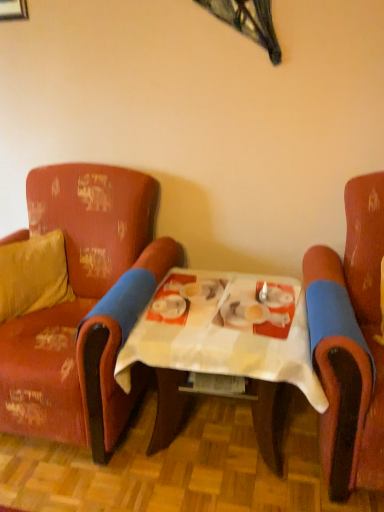
In the scene shown: What is the approximate height of velvet yellow pillow at left?

It is 35.16 centimeters.

Measure the distance between distressed red fabric armchair at left, the first chair in the left-to-right sequence, and camera.

A distance of 1.40 meters exists between distressed red fabric armchair at left, the first chair in the left-to-right sequence, and camera.

This screenshot has height=512, width=384. What do you see at coordinates (220, 338) in the screenshot?
I see `white checkered table at center` at bounding box center [220, 338].

Identify the location of velvet yellow pillow at left. This screenshot has width=384, height=512. (33, 275).

Is white checkered table at center far away from distressed red fabric armchair at left, which appears as the second chair when viewed from the right?

No, white checkered table at center is in close proximity to distressed red fabric armchair at left, which appears as the second chair when viewed from the right.

Is white checkered table at center surrounding distressed red fabric armchair at left, which appears as the second chair when viewed from the right?

No, distressed red fabric armchair at left, which appears as the second chair when viewed from the right, is not surrounded by white checkered table at center.

Which of these two, white checkered table at center or distressed red fabric armchair at left, the first chair in the left-to-right sequence, is smaller?

With smaller size is white checkered table at center.

Is white checkered table at center oriented towards distressed red fabric armchair at left, which appears as the second chair when viewed from the right?

No, white checkered table at center is not aimed at distressed red fabric armchair at left, which appears as the second chair when viewed from the right.

Is white checkered table at center taller than velvet yellow pillow at left?

No, white checkered table at center is not taller than velvet yellow pillow at left.

Is point (153, 324) positioned in front of point (11, 290)?

Yes, it is in front of point (11, 290).

Based on the photo, can you tell me how much white checkered table at center and velvet yellow pillow at left differ in facing direction?

There is a 51.5-degree angle between the facing directions of white checkered table at center and velvet yellow pillow at left.

From a real-world perspective, which is physically above, white checkered table at center or velvet yellow pillow at left?

velvet yellow pillow at left.

Can you tell me how much distressed red fabric armchair at left, the first chair in the left-to-right sequence, and white checkered table at center differ in facing direction?

The facing directions of distressed red fabric armchair at left, the first chair in the left-to-right sequence, and white checkered table at center are 2.26 degrees apart.

Between distressed red fabric armchair at left, which appears as the second chair when viewed from the right, and white checkered table at center, which one is positioned behind?

distressed red fabric armchair at left, which appears as the second chair when viewed from the right, is further from the camera.

Looking at the image, does distressed red fabric armchair at left, which appears as the second chair when viewed from the right, seem bigger or smaller compared to white checkered table at center?

distressed red fabric armchair at left, which appears as the second chair when viewed from the right, is bigger than white checkered table at center.

Is distressed red fabric armchair at left, the first chair in the left-to-right sequence, next to white checkered table at center and touching it?

No, distressed red fabric armchair at left, the first chair in the left-to-right sequence, is not beside white checkered table at center.

In the scene shown: Based on their sizes in the image, would you say distressed red fabric armchair at left, which appears as the second chair when viewed from the right, is bigger or smaller than velvet yellow pillow at left?

Clearly, distressed red fabric armchair at left, which appears as the second chair when viewed from the right, is larger in size than velvet yellow pillow at left.

Would you say distressed red fabric armchair at left, which appears as the second chair when viewed from the right, is inside or outside velvet yellow pillow at left?

distressed red fabric armchair at left, which appears as the second chair when viewed from the right, lies outside velvet yellow pillow at left.

Based on the photo, is distressed red fabric armchair at left, the first chair in the left-to-right sequence, beside velvet yellow pillow at left?

There is a gap between distressed red fabric armchair at left, the first chair in the left-to-right sequence, and velvet yellow pillow at left.

Is distressed red fabric armchair at left, which appears as the second chair when viewed from the right, oriented away from velvet yellow pillow at left?

Yes, distressed red fabric armchair at left, which appears as the second chair when viewed from the right,'s orientation is away from velvet yellow pillow at left.

Is scratched leather armchair at right, placed as the 1th chair when sorted from right to left, directly adjacent to velvet yellow pillow at left?

scratched leather armchair at right, placed as the 1th chair when sorted from right to left, and velvet yellow pillow at left are clearly separated.

Considering the positions of objects scratched leather armchair at right, marked as the 2th chair in a left-to-right arrangement, and velvet yellow pillow at left in the image provided, who is in front, scratched leather armchair at right, marked as the 2th chair in a left-to-right arrangement, or velvet yellow pillow at left?

scratched leather armchair at right, marked as the 2th chair in a left-to-right arrangement, is more forward.

Can you tell me how much scratched leather armchair at right, marked as the 2th chair in a left-to-right arrangement, and velvet yellow pillow at left differ in facing direction?

49.3 degrees.

Considering the relative sizes of scratched leather armchair at right, marked as the 2th chair in a left-to-right arrangement, and velvet yellow pillow at left in the image provided, is scratched leather armchair at right, marked as the 2th chair in a left-to-right arrangement, bigger than velvet yellow pillow at left?

Yes, scratched leather armchair at right, marked as the 2th chair in a left-to-right arrangement, is bigger than velvet yellow pillow at left.

Are scratched leather armchair at right, placed as the 1th chair when sorted from right to left, and white checkered table at center far apart?

Actually, scratched leather armchair at right, placed as the 1th chair when sorted from right to left, and white checkered table at center are a little close together.

Is scratched leather armchair at right, marked as the 2th chair in a left-to-right arrangement, wider or thinner than white checkered table at center?

scratched leather armchair at right, marked as the 2th chair in a left-to-right arrangement, is wider than white checkered table at center.

Visually, is scratched leather armchair at right, marked as the 2th chair in a left-to-right arrangement, positioned to the left or to the right of white checkered table at center?

Clearly, scratched leather armchair at right, marked as the 2th chair in a left-to-right arrangement, is on the right of white checkered table at center in the image.

From a real-world perspective, which object rests below the other?

From a 3D spatial view, white checkered table at center is below.

Which is more to the right, scratched leather armchair at right, placed as the 1th chair when sorted from right to left, or distressed red fabric armchair at left, which appears as the second chair when viewed from the right?

Positioned to the right is scratched leather armchair at right, placed as the 1th chair when sorted from right to left.

Who is shorter, scratched leather armchair at right, marked as the 2th chair in a left-to-right arrangement, or distressed red fabric armchair at left, which appears as the second chair when viewed from the right?

Standing shorter between the two is distressed red fabric armchair at left, which appears as the second chair when viewed from the right.

At what (x,y) coordinates should I click in order to perform the action: click on chair behind the scratched leather armchair at right, placed as the 1th chair when sorted from right to left. Please return your answer as a coordinate pair (x, y). The image size is (384, 512). Looking at the image, I should click on (84, 306).

Locate an element on the screen. This screenshot has height=512, width=384. chair that is the 2nd one when counting upward from the white checkered table at center (from the image's perspective) is located at coordinates (84, 306).

What are the coordinates of `pillow to the left of white checkered table at center` in the screenshot? It's located at (33, 275).

Based on their spatial positions, is white checkered table at center or distressed red fabric armchair at left, the first chair in the left-to-right sequence, closer to scratched leather armchair at right, marked as the 2th chair in a left-to-right arrangement?

white checkered table at center is closer to scratched leather armchair at right, marked as the 2th chair in a left-to-right arrangement.

Considering their positions, is scratched leather armchair at right, marked as the 2th chair in a left-to-right arrangement, positioned closer to white checkered table at center than velvet yellow pillow at left?

scratched leather armchair at right, marked as the 2th chair in a left-to-right arrangement, is closer to white checkered table at center.

Considering their positions, is white checkered table at center positioned closer to distressed red fabric armchair at left, which appears as the second chair when viewed from the right, than velvet yellow pillow at left?

Among the two, velvet yellow pillow at left is located nearer to distressed red fabric armchair at left, which appears as the second chair when viewed from the right.

Consider the image. Considering their positions, is distressed red fabric armchair at left, the first chair in the left-to-right sequence, positioned closer to scratched leather armchair at right, placed as the 1th chair when sorted from right to left, than velvet yellow pillow at left?

distressed red fabric armchair at left, the first chair in the left-to-right sequence, is closer to scratched leather armchair at right, placed as the 1th chair when sorted from right to left.

Estimate the real-world distances between objects in this image. Which object is closer to distressed red fabric armchair at left, which appears as the second chair when viewed from the right, velvet yellow pillow at left or scratched leather armchair at right, placed as the 1th chair when sorted from right to left?

Among the two, velvet yellow pillow at left is located nearer to distressed red fabric armchair at left, which appears as the second chair when viewed from the right.

Based on their spatial positions, is white checkered table at center or scratched leather armchair at right, marked as the 2th chair in a left-to-right arrangement, closer to velvet yellow pillow at left?

white checkered table at center.

When comparing their distances from white checkered table at center, does scratched leather armchair at right, marked as the 2th chair in a left-to-right arrangement, or distressed red fabric armchair at left, the first chair in the left-to-right sequence, seem closer?

The object closer to white checkered table at center is scratched leather armchair at right, marked as the 2th chair in a left-to-right arrangement.

Considering their positions, is velvet yellow pillow at left positioned closer to white checkered table at center than scratched leather armchair at right, marked as the 2th chair in a left-to-right arrangement?

scratched leather armchair at right, marked as the 2th chair in a left-to-right arrangement, is closer to white checkered table at center.

Locate an element on the screen. This screenshot has width=384, height=512. table located between distressed red fabric armchair at left, the first chair in the left-to-right sequence, and scratched leather armchair at right, marked as the 2th chair in a left-to-right arrangement, in the left-right direction is located at coordinates (220, 338).

At what (x,y) coordinates should I click in order to perform the action: click on chair situated between velvet yellow pillow at left and white checkered table at center from left to right. Please return your answer as a coordinate pair (x, y). Looking at the image, I should click on (84, 306).

This screenshot has width=384, height=512. In order to click on chair between velvet yellow pillow at left and scratched leather armchair at right, marked as the 2th chair in a left-to-right arrangement, in the horizontal direction in this screenshot , I will do `click(84, 306)`.

I want to click on table situated between velvet yellow pillow at left and scratched leather armchair at right, marked as the 2th chair in a left-to-right arrangement, from left to right, so click(x=220, y=338).